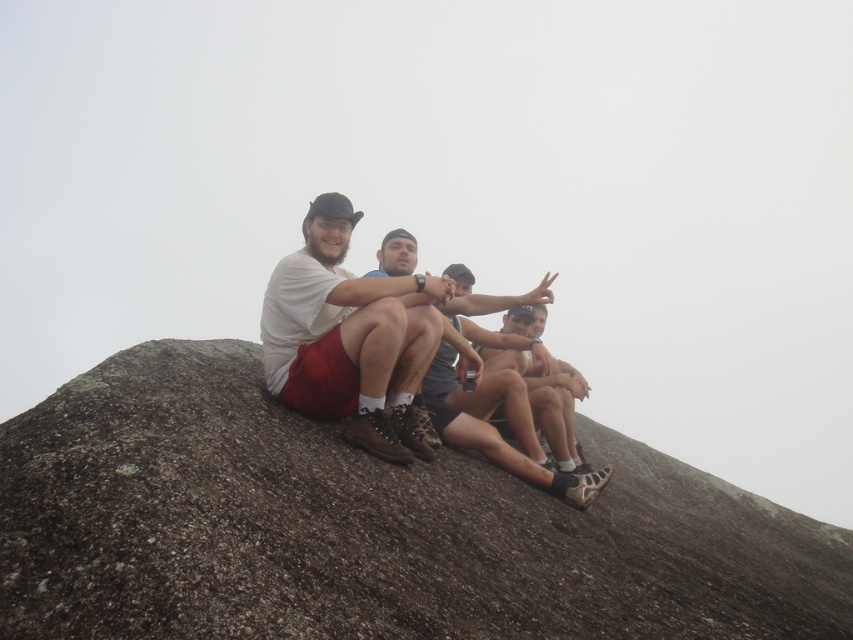
Question: Which of the following is the farthest from the observer?

Choices:
 (A) (486, 632)
 (B) (328, 408)

Answer: (B)

Question: Can you confirm if brown rough rock at center is wider than matte white t-shirt at center?

Choices:
 (A) yes
 (B) no

Answer: (A)

Question: Which of the following is the farthest from the observer?

Choices:
 (A) (355, 428)
 (B) (712, 556)

Answer: (B)

Question: Is brown rough rock at center positioned at the back of matte white t-shirt at center?

Choices:
 (A) yes
 (B) no

Answer: (B)

Question: Which point appears farthest from the camera in this image?

Choices:
 (A) (364, 444)
 (B) (165, 595)

Answer: (A)

Question: From the image, what is the correct spatial relationship of brown rough rock at center in relation to matte white t-shirt at center?

Choices:
 (A) above
 (B) below

Answer: (B)